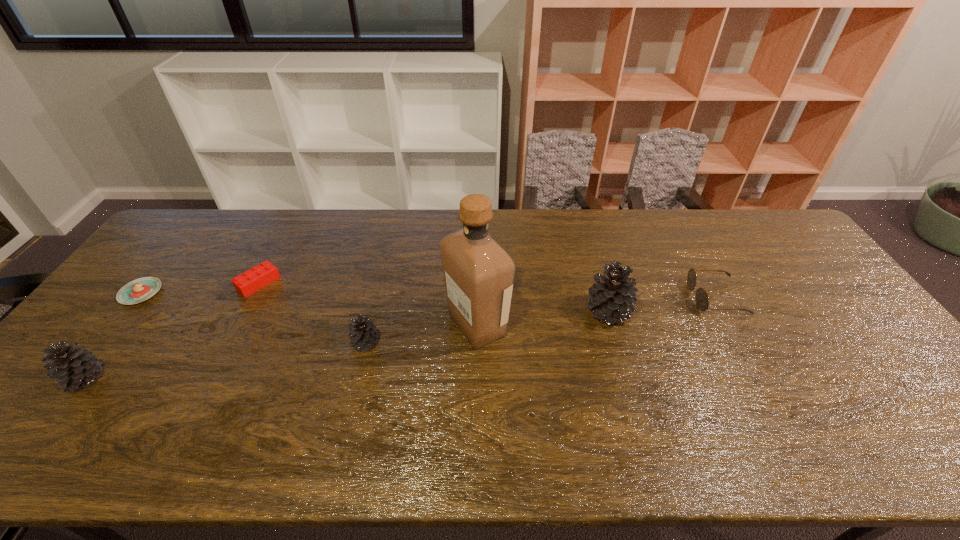
In order to click on free region at the far right corner of the desktop in this screenshot , I will do `click(765, 213)`.

The height and width of the screenshot is (540, 960). I want to click on vacant region at the near right corner, so click(x=868, y=406).

At what (x,y) coordinates should I click in order to perform the action: click on free spot between the fifth shortest object and the second nearest pinecone. Please return your answer as a coordinate pair (x, y). Looking at the image, I should click on (225, 360).

At what (x,y) coordinates should I click in order to perform the action: click on vacant space in between the fourth tallest object and the pastry. Please return your answer as a coordinate pair (x, y). Image resolution: width=960 pixels, height=540 pixels. Looking at the image, I should click on (252, 318).

Identify the location of free area in between the fifth object from left to right and the farthest pinecone. (542, 319).

Locate an element on the screen. free space that is in between the tallest object and the shortest object is located at coordinates click(x=309, y=309).

At what (x,y) coordinates should I click in order to perform the action: click on vacant space in between the tallest object and the shortest object. Please return your answer as a coordinate pair (x, y). The image size is (960, 540). Looking at the image, I should click on (309, 309).

The image size is (960, 540). What are the coordinates of `free space between the third tallest object and the tallest object` in the screenshot? It's located at (281, 352).

This screenshot has width=960, height=540. In order to click on free space between the fifth tallest object and the nearest object in this screenshot , I will do `click(400, 338)`.

The width and height of the screenshot is (960, 540). I want to click on the fifth closest object to the liquor, so click(x=74, y=367).